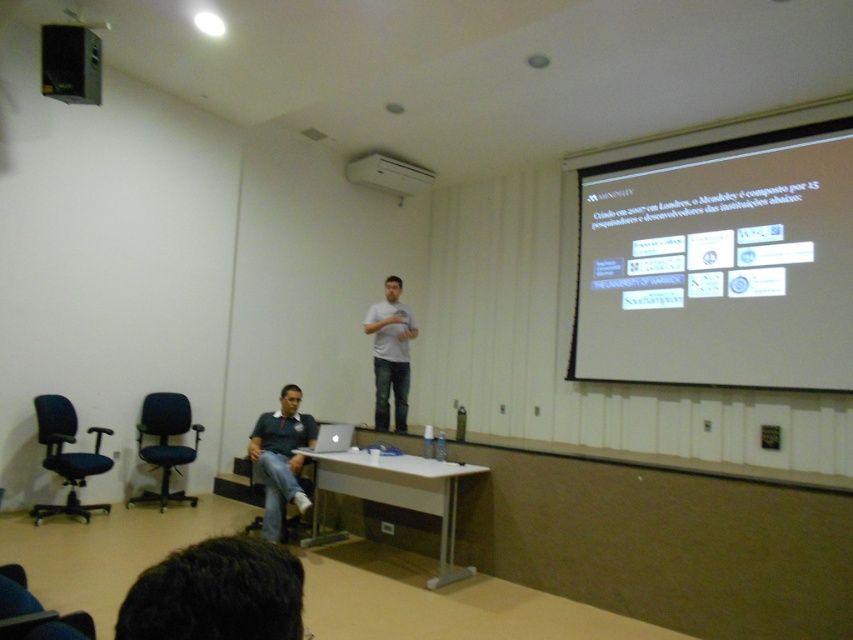
You are a presenter standing at the front of the room. You need to walk to the silver metallic laptop at lower center to continue your presentation. There is a black mesh office chair at left in the way. Is there enough space to walk around the chair without moving it?

The distance between the black mesh office chair at left and the silver metallic laptop at lower center is 5.46 feet. Since the chair is not blocking the direct path and there is sufficient space around it, you can easily walk around the chair without moving it.

In the scene shown: What is the color of the fabric at the point marked by the coordinates (280,458)?

The point marked by the coordinates (280,458) corresponds to the green fabric shirt at lower left.